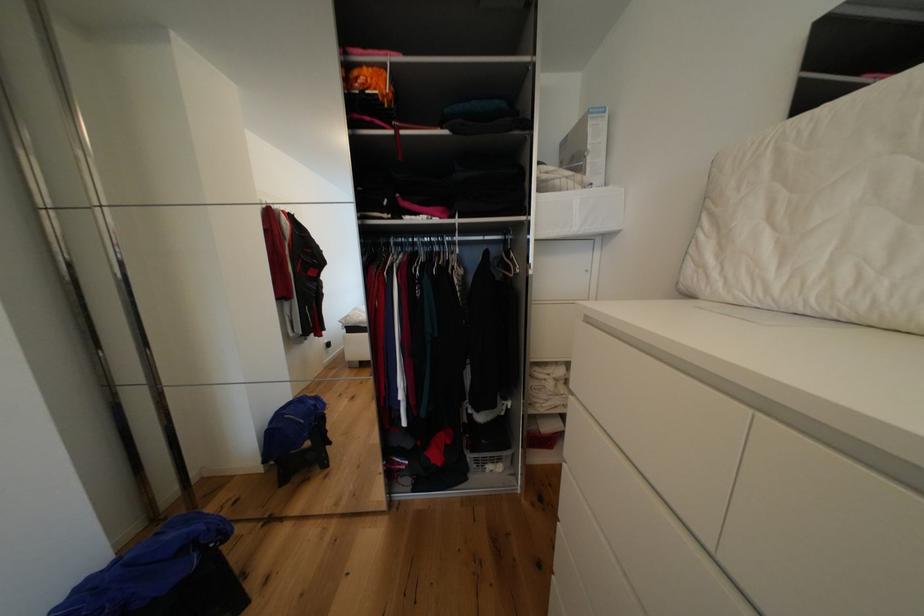
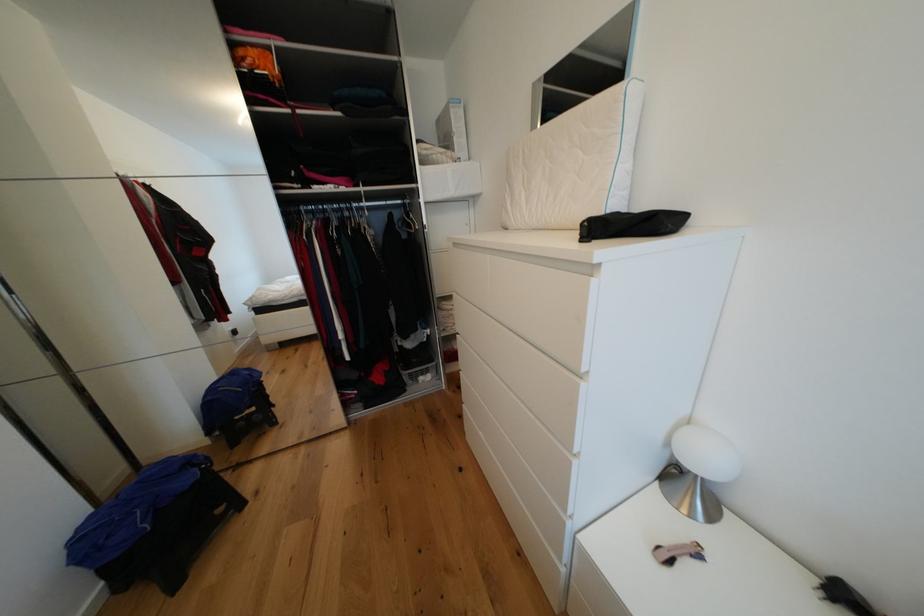
Question: How did the camera likely rotate?

Choices:
 (A) Left
 (B) Right
 (C) Up
 (D) Down

Answer: (B)